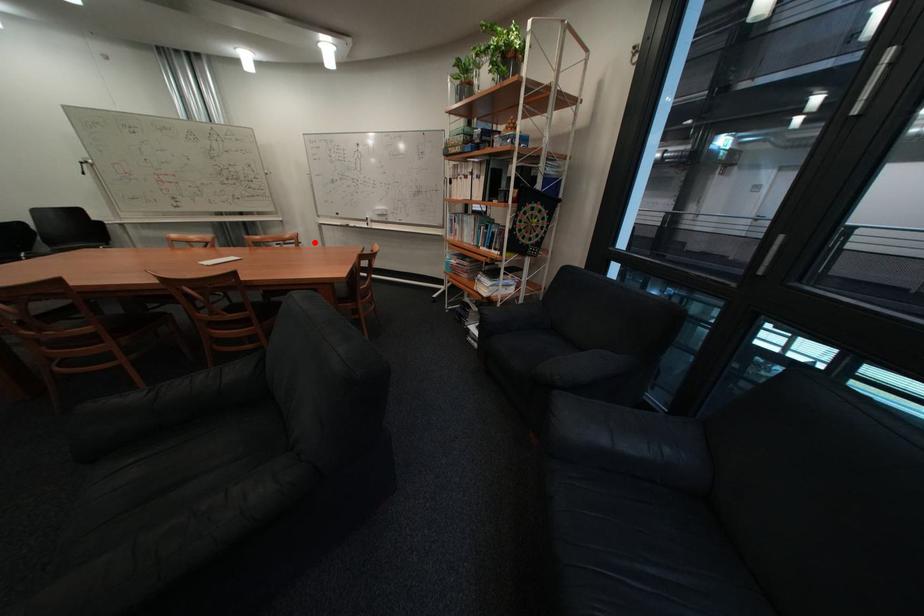
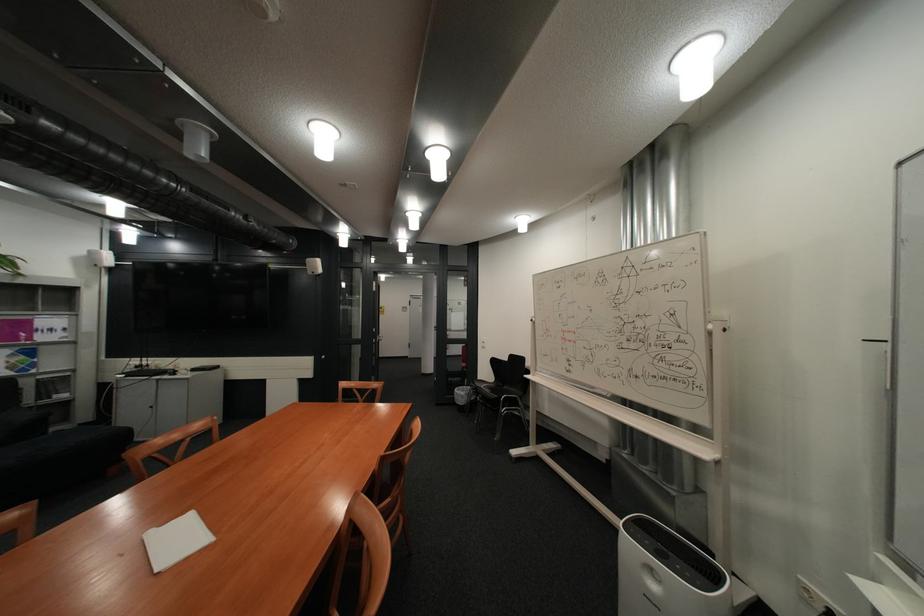
Question: I am providing you with two images of the same scene from different viewpoints. In image1, a red point is highlighted. Considering the same 3D point in image2, which of the following is correct?

Choices:
 (A) It is closer
 (B) It is farther

Answer: (A)